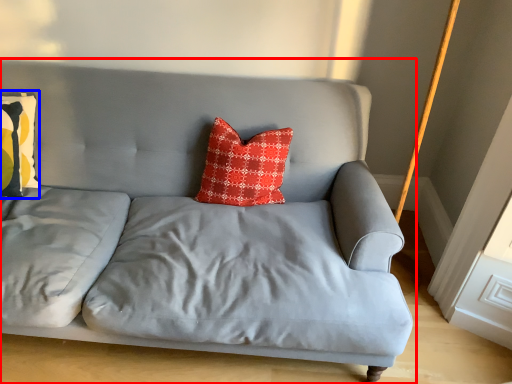
Question: Which object appears closest to the camera in this image, studio couch (highlighted by a red box) or pillow (highlighted by a blue box)?

Choices:
 (A) studio couch
 (B) pillow

Answer: (A)